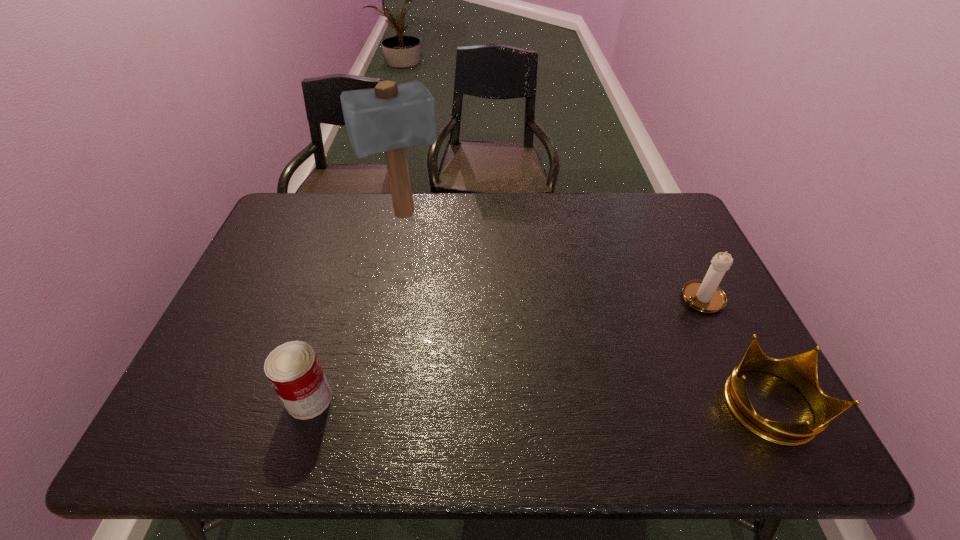
Identify the location of blank space that satisfies the following two spatial constraints: 1. on the front side of the crown; 2. on the right side of the candle holder. Image resolution: width=960 pixels, height=540 pixels. (752, 405).